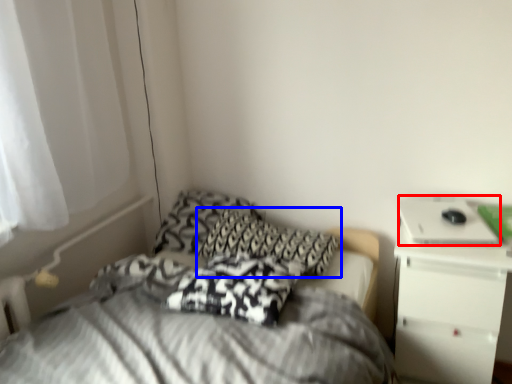
Question: Which of the following is the farthest to the observer, laptop (highlighted by a red box) or pillow (highlighted by a blue box)?

Choices:
 (A) laptop
 (B) pillow

Answer: (B)